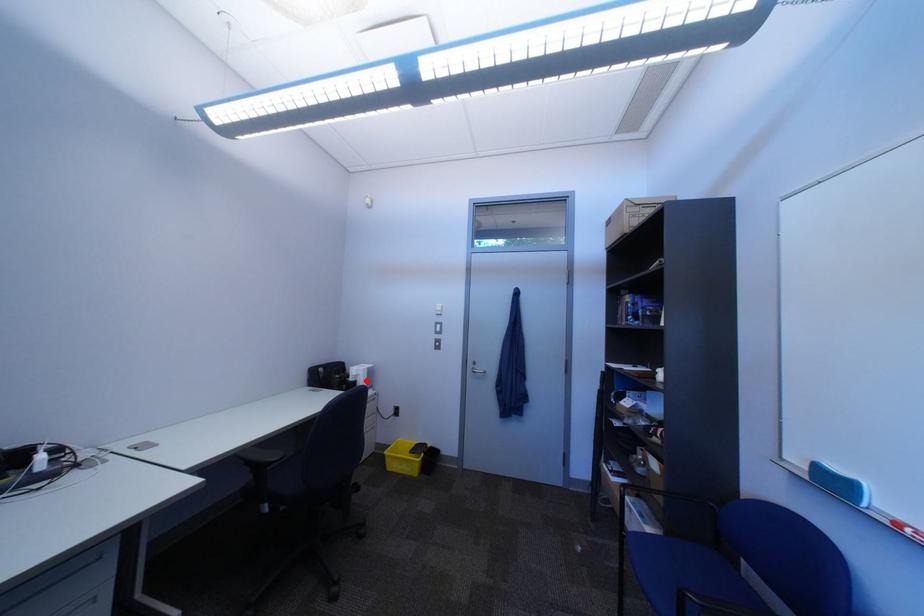
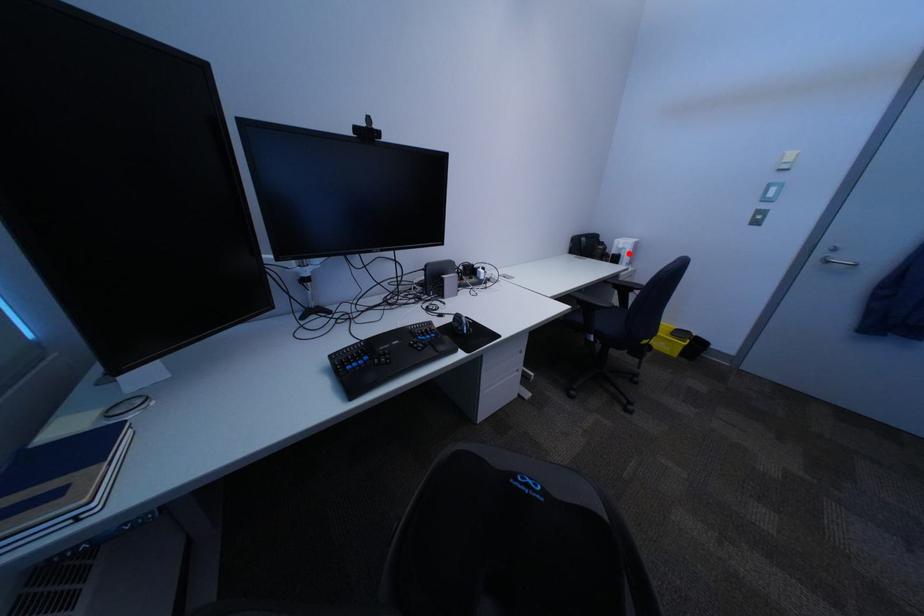
I am providing you with two images of the same scene from different viewpoints. A red point is marked on the first image and another point is marked on the second image. Does the point marked in image1 correspond to the same location as the one in image2?

Yes